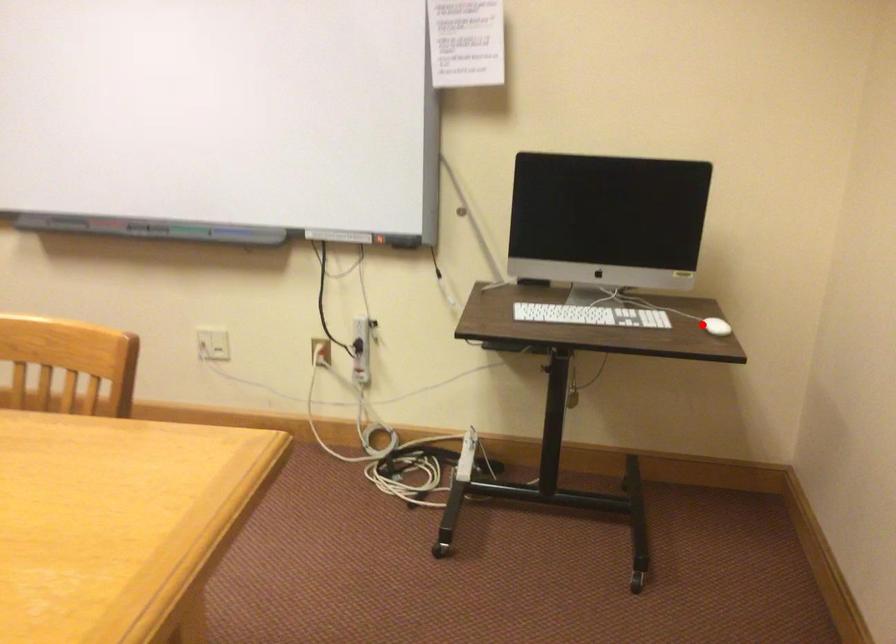
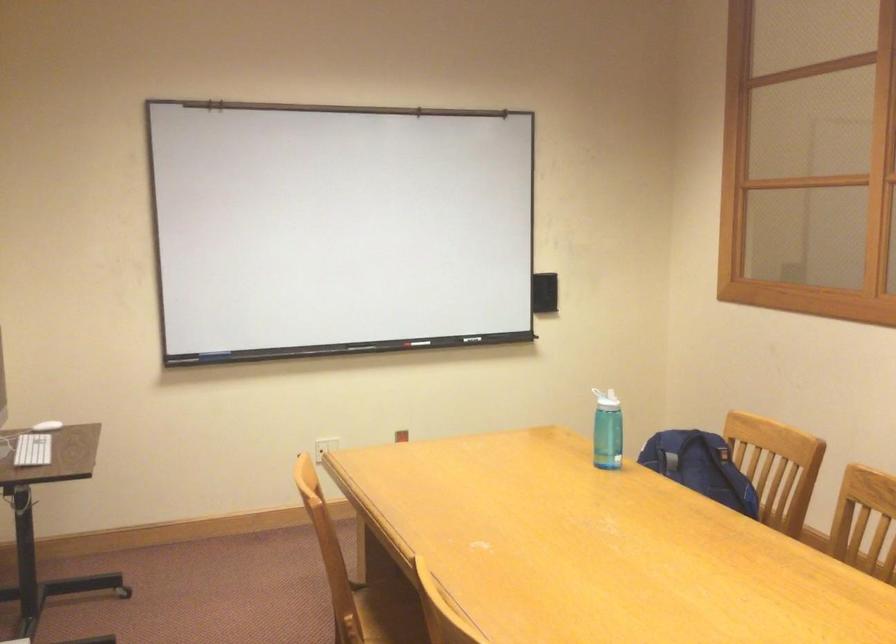
Question: A red point is marked in image1. In image2, is the corresponding 3D point closer to the camera or farther? Reply with the corresponding letter.

Choices:
 (A) The corresponding 3D point is closer.
 (B) The corresponding 3D point is farther.

Answer: (B)